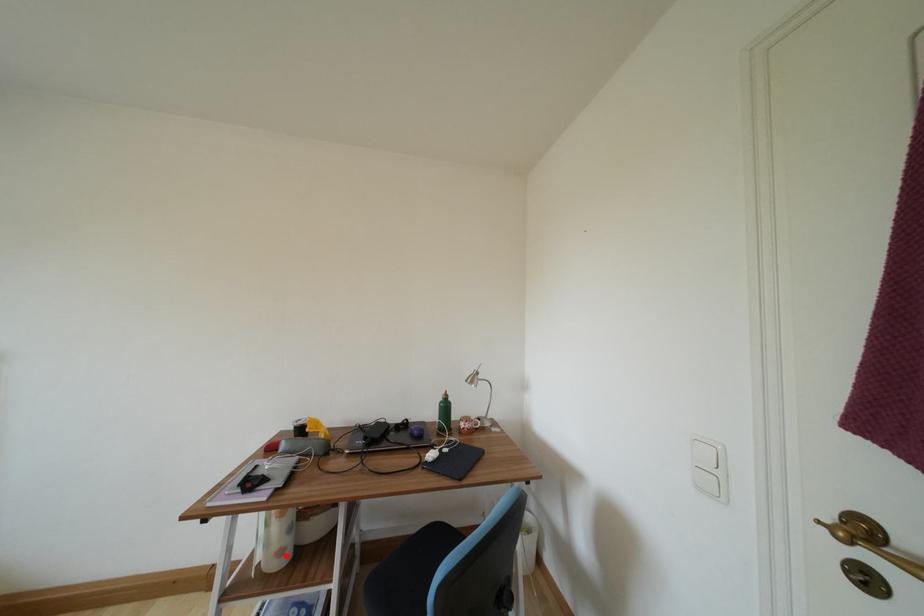
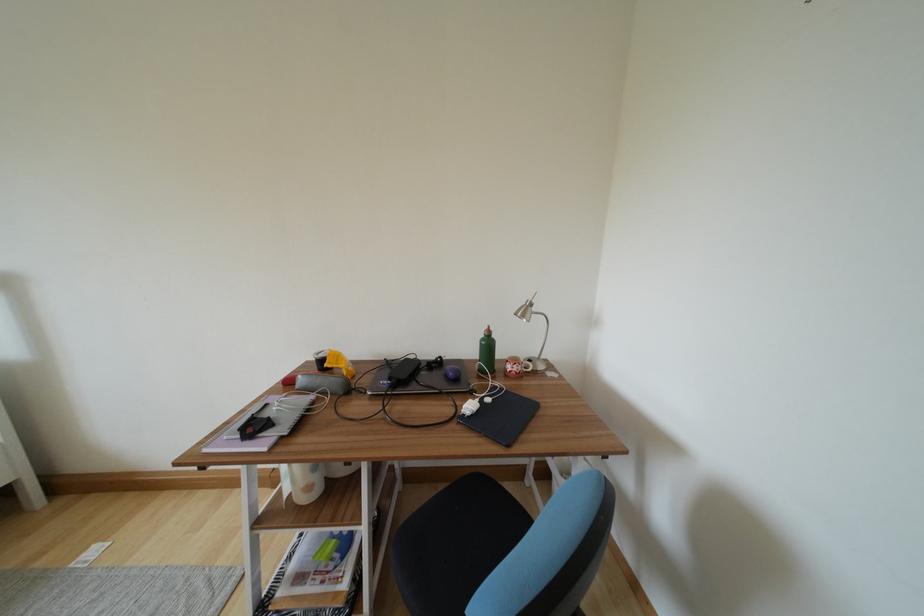
In the second image, find the point that corresponds to the highlighted location in the first image.

(313, 492)